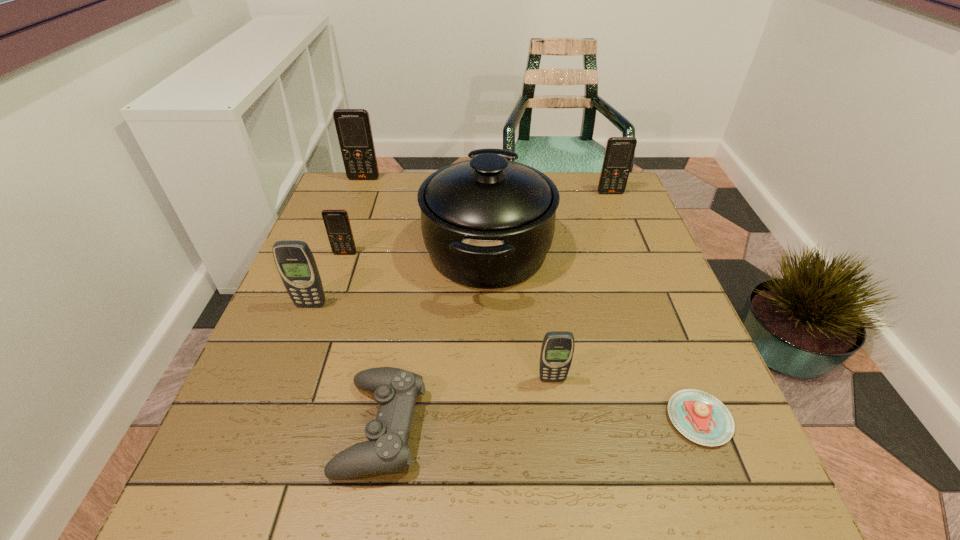
This screenshot has width=960, height=540. Find the location of `free space that is in between the third nearest cellular telephone and the black saucepan`. free space that is in between the third nearest cellular telephone and the black saucepan is located at coordinates (417, 252).

This screenshot has height=540, width=960. Find the location of `vacant space that is in between the farthest object and the smallest orange cellular telephone`. vacant space that is in between the farthest object and the smallest orange cellular telephone is located at coordinates (354, 216).

Where is `vacant region between the gray control and the nearer gray cellular telephone`? vacant region between the gray control and the nearer gray cellular telephone is located at coordinates (467, 403).

Find the location of a particular element. the fourth closest object relative to the second farthest orange cellular telephone is located at coordinates (702, 418).

Identify the location of object that stands as the second closest to the smallest orange cellular telephone. (488, 223).

Point out which cellular telephone is positioned as the third nearest to the farthest orange cellular telephone. Please provide its 2D coordinates. Your answer should be formatted as a tuple, i.e. [(x, y)], where the tuple contains the x and y coordinates of a point satisfying the conditions above.

[(619, 152)]

Where is `the second closest cellular telephone to the nearest cellular telephone`? the second closest cellular telephone to the nearest cellular telephone is located at coordinates (336, 221).

Find the location of a particular element. This screenshot has width=960, height=540. orange cellular telephone that can be found as the closest to the second farthest orange cellular telephone is located at coordinates [x=353, y=126].

Identify which orange cellular telephone is located as the second nearest to the third farthest cellular telephone. Please provide its 2D coordinates. Your answer should be formatted as a tuple, i.e. [(x, y)], where the tuple contains the x and y coordinates of a point satisfying the conditions above.

[(619, 152)]

Locate an element on the screen. The width and height of the screenshot is (960, 540). vacant region that satisfies the following two spatial constraints: 1. on the screen of the nearest orange cellular telephone; 2. on the left side of the pastry is located at coordinates tap(288, 419).